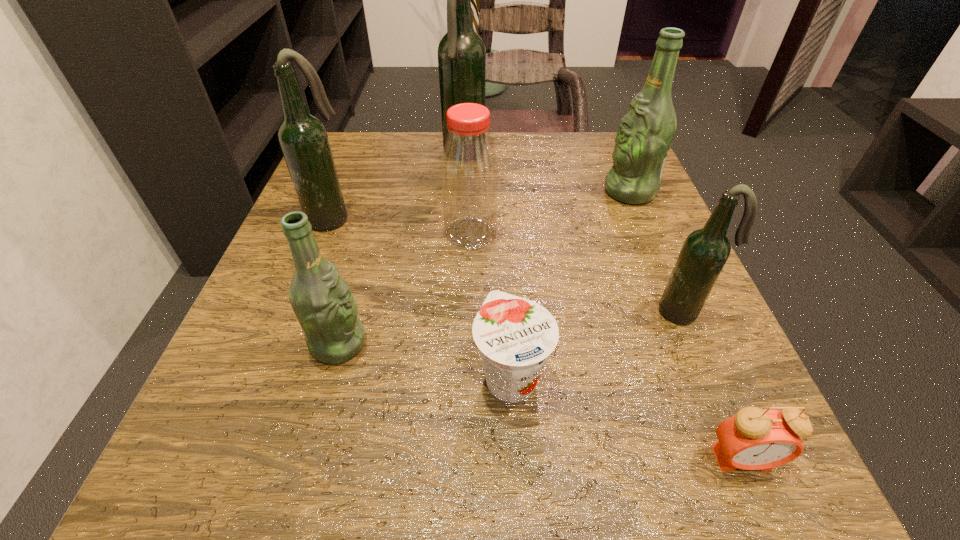
Where is `free location located 0.220m on the front of the nearest dark beer bottle`? This screenshot has width=960, height=540. free location located 0.220m on the front of the nearest dark beer bottle is located at coordinates (756, 480).

I want to click on vacant region located on the surface of the second beer bottle from left to right, so click(416, 343).

At what (x,y) coordinates should I click in order to perform the action: click on free space located 0.100m on the front of the yogurt. Please return your answer as a coordinate pair (x, y). The width and height of the screenshot is (960, 540). Looking at the image, I should click on (517, 501).

Locate an element on the screen. object positioned at the near edge is located at coordinates (754, 439).

Locate an element on the screen. alarm clock located in the right edge section of the desktop is located at coordinates (754, 439).

At what (x,y) coordinates should I click in order to perform the action: click on object present at the far right corner. Please return your answer as a coordinate pair (x, y). The image size is (960, 540). Looking at the image, I should click on (646, 132).

Image resolution: width=960 pixels, height=540 pixels. Find the location of `object present at the near right corner`. object present at the near right corner is located at coordinates (754, 439).

At what (x,y) coordinates should I click in order to perform the action: click on free region at the far edge of the desktop. Please return your answer as a coordinate pair (x, y). Looking at the image, I should click on (545, 142).

Where is `free space at the near edge`? The image size is (960, 540). free space at the near edge is located at coordinates (489, 498).

Image resolution: width=960 pixels, height=540 pixels. I want to click on vacant space at the left edge of the desktop, so click(326, 421).